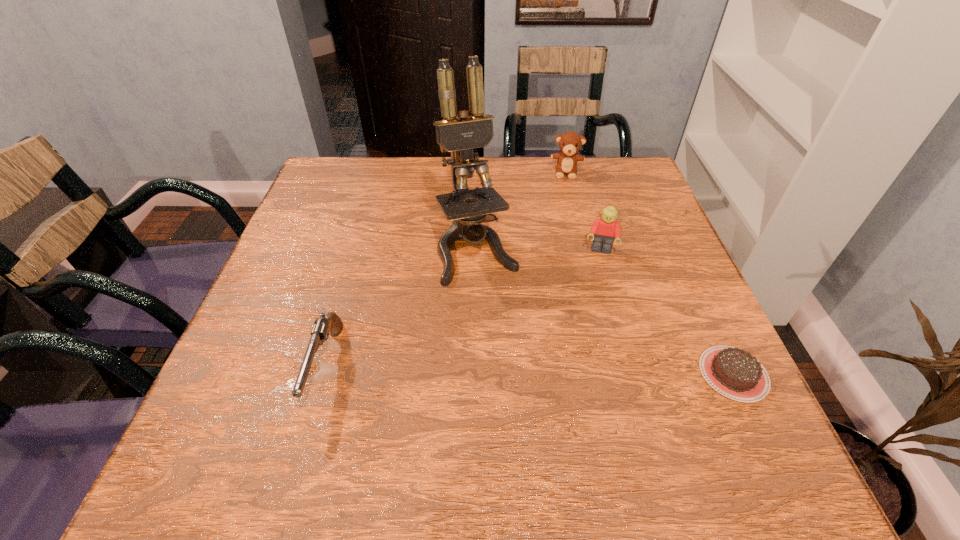
Locate an element on the screen. the fourth tallest object is located at coordinates (320, 332).

This screenshot has width=960, height=540. What are the coordinates of `the leftmost object` in the screenshot? It's located at (320, 332).

Locate an element on the screen. the rightmost object is located at coordinates (736, 374).

Find the location of a particular element. Image resolution: width=960 pixels, height=540 pixels. the shortest object is located at coordinates (736, 374).

I want to click on microscope, so click(x=459, y=134).

Find the location of a particular element. Image resolution: width=960 pixels, height=540 pixels. the tallest object is located at coordinates (459, 134).

Identify the location of teddy bear. (570, 142).

Locate an element on the screen. The width and height of the screenshot is (960, 540). Lego is located at coordinates (606, 229).

What are the coordinates of `vacant space positioned on the back of the rightmost object` in the screenshot? It's located at (702, 307).

Identify the location of vacant space situated 0.180m at the eyepieces of the second object from left to right. (517, 352).